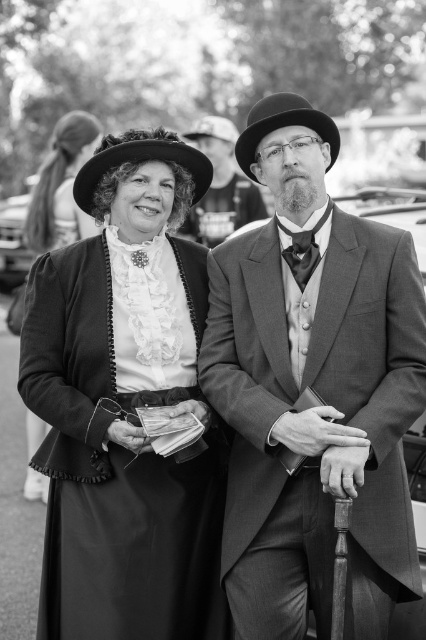
Based on the photo, is smooth leather hat at center positioned behind felt hat at upper left?

Yes, it is.

Between smooth leather hat at center and felt hat at upper left, which one appears on the left side from the viewer's perspective?

felt hat at upper left

Where is `smooth leather hat at center`? This screenshot has width=426, height=640. smooth leather hat at center is located at coordinates (221, 186).

Between matte black dress at center and smooth leather hat at center, which one appears on the right side from the viewer's perspective?

smooth leather hat at center

In the scene shown: Can you confirm if matte black dress at center is positioned to the right of smooth leather hat at center?

In fact, matte black dress at center is to the left of smooth leather hat at center.

The width and height of the screenshot is (426, 640). I want to click on matte black dress at center, so click(x=62, y=186).

Is ruffled satin dress at center to the left of shiny black bowler hat at center from the viewer's perspective?

Indeed, ruffled satin dress at center is positioned on the left side of shiny black bowler hat at center.

Who is more distant from viewer, (108, 516) or (296, 109)?

Positioned behind is point (108, 516).

Where is `ruffled satin dress at center`? This screenshot has height=640, width=426. ruffled satin dress at center is located at coordinates (112, 477).